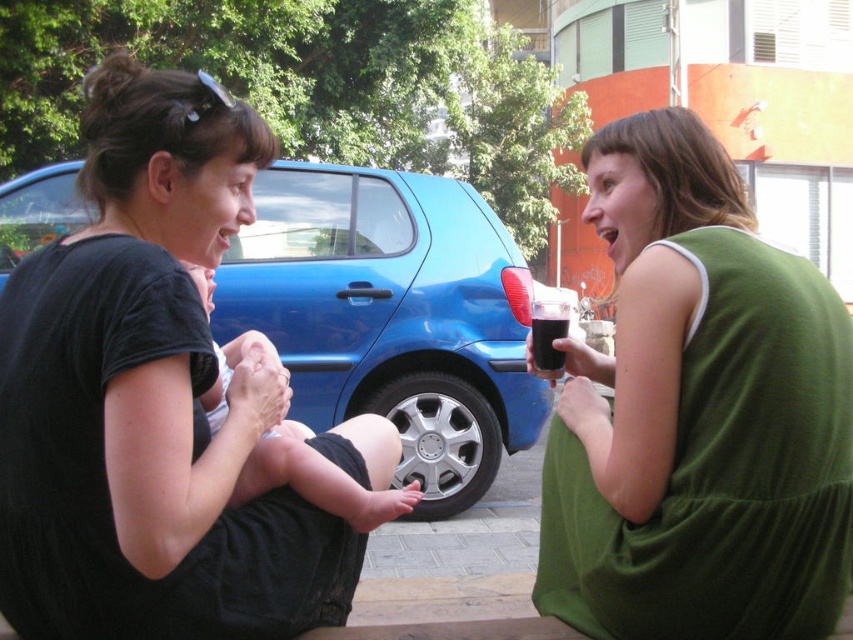
You are standing in the scene and want to hand a gift to the person wearing the green fabric dress at center. Which direction should you walk to approach them?

The green fabric dress at center is located at point (697,413), so you should walk towards the center of the scene to reach them.

You are a photographer trying to capture a closeup of the soft skin baby at center without the blue metallic car at center obstructing the shot. Is the car too big to avoid blocking the baby?

The blue metallic car at center is larger in size than the soft skin baby at center, so it might obstruct the shot if positioned between them. Adjust the angle to ensure the car doesn